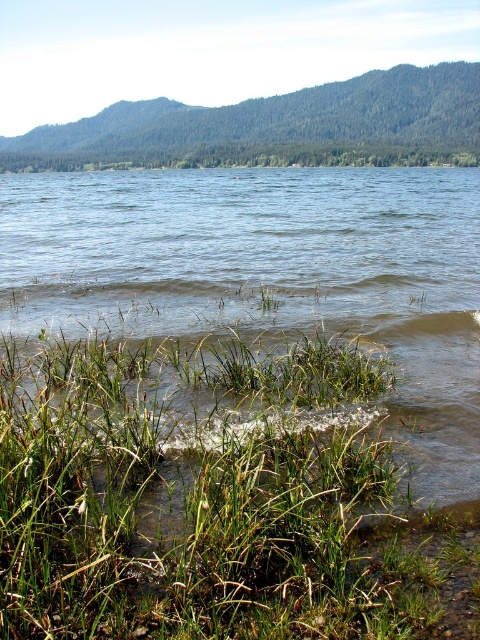
Question: Which point is farther to the camera?

Choices:
 (A) green grassy at lower left
 (B) green grass at lower center

Answer: (B)

Question: Is green grassy at lower left bigger than green grass at lower center?

Choices:
 (A) no
 (B) yes

Answer: (A)

Question: Can you confirm if green grassy at lower left is positioned to the left of green grass at lower center?

Choices:
 (A) yes
 (B) no

Answer: (B)

Question: Does green grassy at lower left appear on the left side of green grass at lower center?

Choices:
 (A) yes
 (B) no

Answer: (B)

Question: Among these points, which one is farthest from the camera?

Choices:
 (A) (73, 624)
 (B) (432, 221)

Answer: (B)